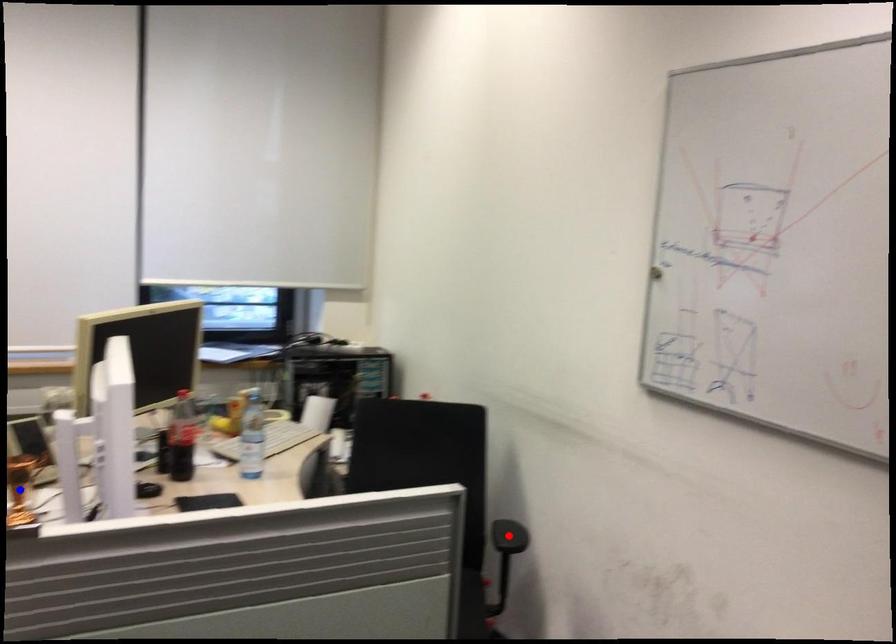
Question: In the image, two points are highlighted. Which point is nearer to the camera? Reply with the corresponding letter.

Choices:
 (A) blue point
 (B) red point

Answer: (A)